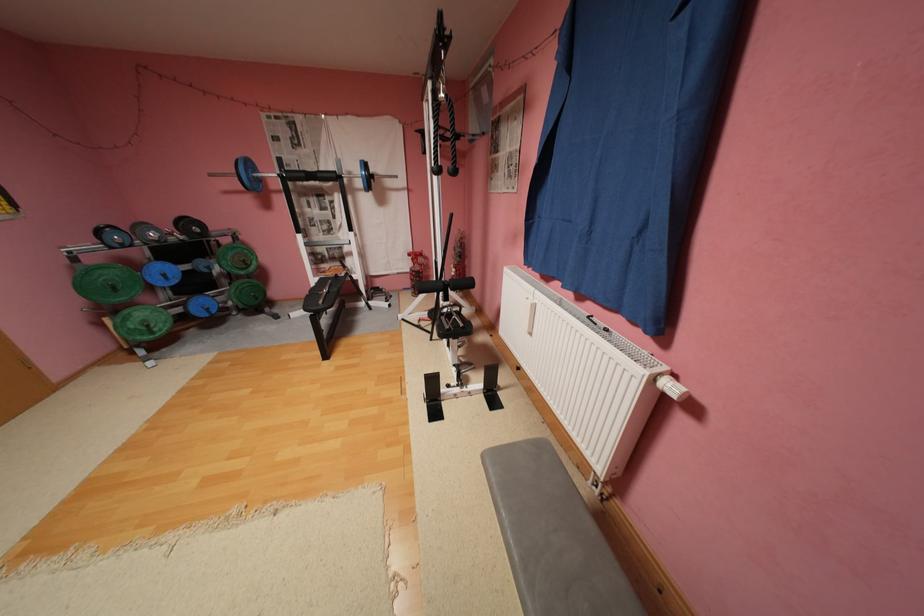
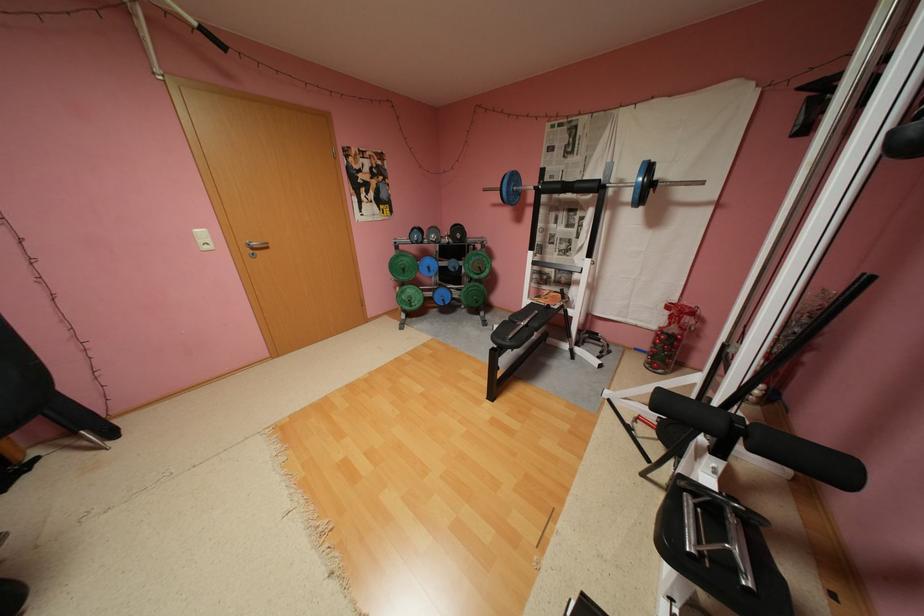
The point at (253, 261) is marked in the first image. Where is the corresponding point in the second image?

(489, 267)